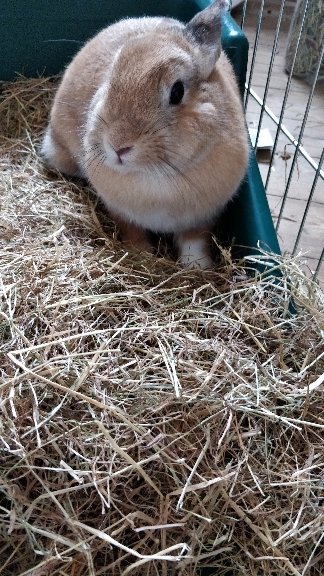
This screenshot has width=324, height=576. I want to click on wood flooring, so [x=300, y=188].